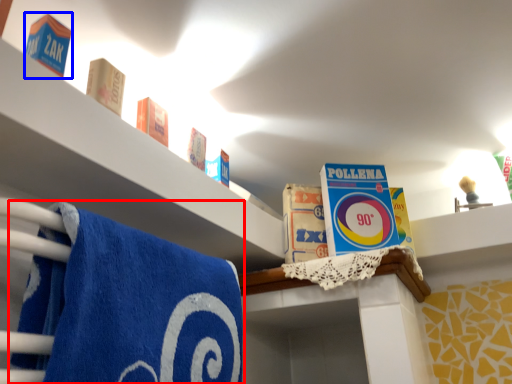
Question: Which point is further to the camera, towel (highlighted by a red box) or product (highlighted by a blue box)?

Choices:
 (A) towel
 (B) product

Answer: (B)